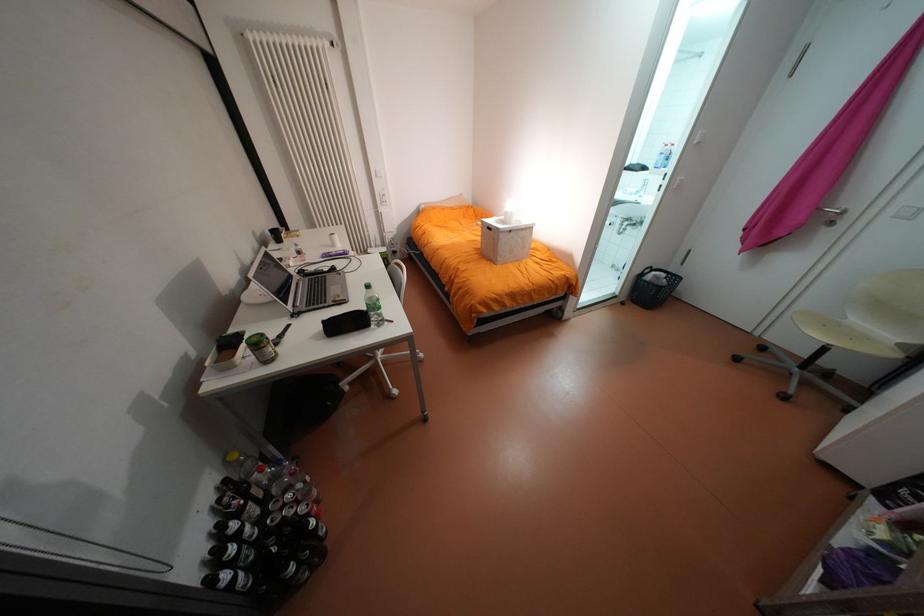
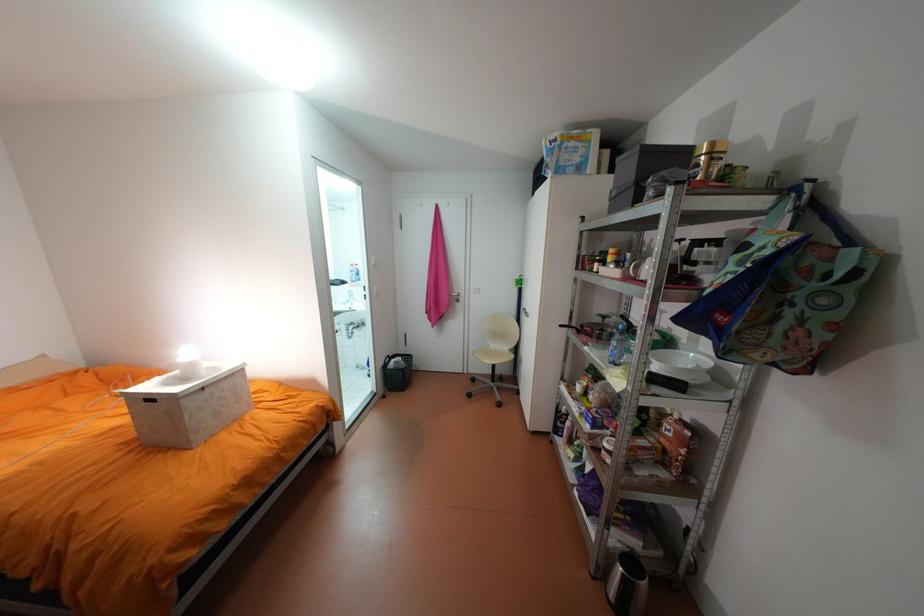
Question: The camera is either moving clockwise (left) or counter-clockwise (right) around the object. The first image is from the beginning of the video and the second image is from the end. Is the camera moving left or right when shooting the video?

Choices:
 (A) Left
 (B) Right

Answer: (A)